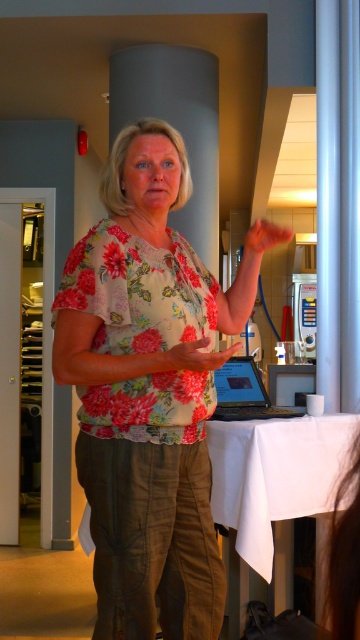
Is black glossy laptop at center in front of matte floral shirt at center?

No, it is not.

Is black glossy laptop at center behind matte floral shirt at center?

Yes.

Describe the element at coordinates (244, 392) in the screenshot. I see `black glossy laptop at center` at that location.

This screenshot has height=640, width=360. I want to click on black glossy laptop at center, so click(x=244, y=392).

Who is more forward, (127, 419) or (228, 380)?

Point (127, 419) is more forward.

The height and width of the screenshot is (640, 360). Describe the element at coordinates (146, 394) in the screenshot. I see `floral fabric blouse at center` at that location.

This screenshot has height=640, width=360. I want to click on floral fabric blouse at center, so click(x=146, y=394).

What do you see at coordinates (275, 476) in the screenshot? This screenshot has height=640, width=360. I see `white cloth at center` at bounding box center [275, 476].

Which of these two, white cloth at center or matte floral shirt at center, stands taller?

white cloth at center is taller.

Locate an element on the screen. This screenshot has width=360, height=640. white cloth at center is located at coordinates (275, 476).

Find the location of a particular element. The height and width of the screenshot is (640, 360). white cloth at center is located at coordinates (275, 476).